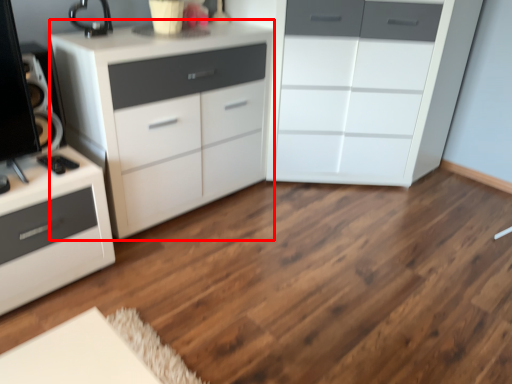
Question: From the image's perspective, where is chest of drawers (annotated by the red box) located in relation to chest of drawers in the image?

Choices:
 (A) above
 (B) below

Answer: (B)